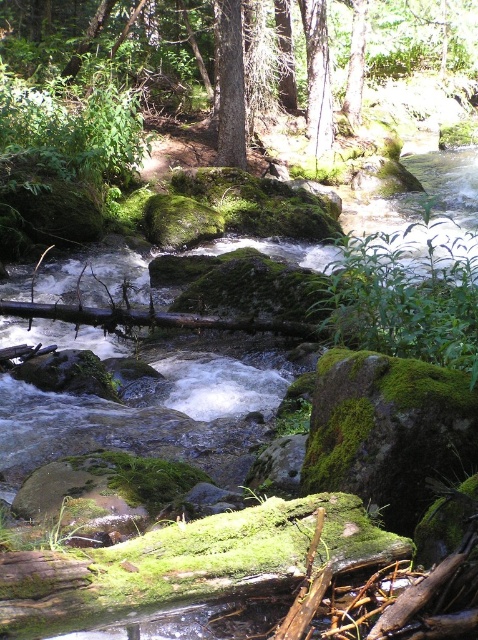
In the scene shown: Is green mossy rock at center thinner than green matte tree at center?

No.

Between green mossy rock at center and green matte tree at center, which one has more height?

green mossy rock at center is taller.

At what (x,y) coordinates should I click in order to perform the action: click on green mossy rock at center. Please return your answer as a coordinate pair (x, y). Looking at the image, I should click on (118, 40).